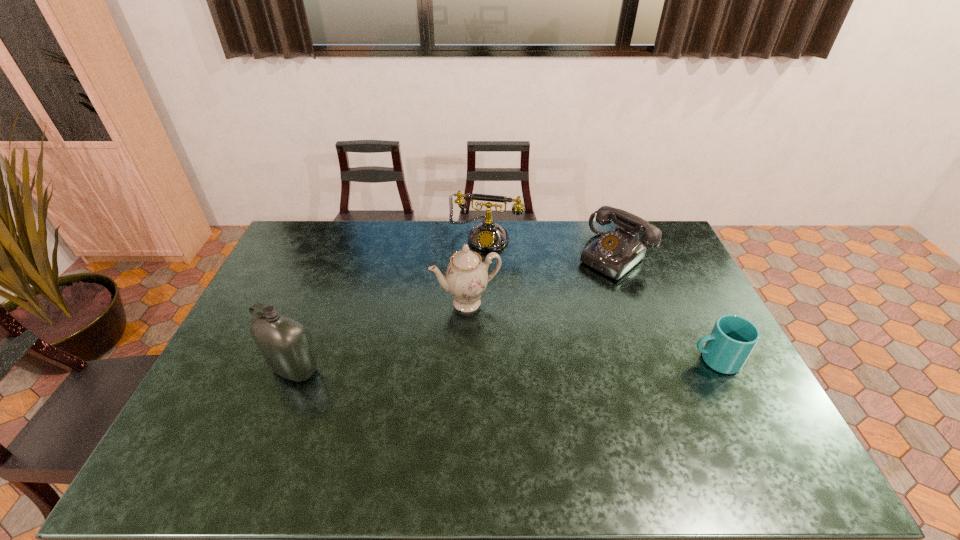
The image size is (960, 540). Identify the location of vacant spot on the desktop that is between the bottle and the cup and is positioned on the spout of the third nearest object. 493,364.

Locate an element on the screen. This screenshot has height=540, width=960. vacant space on the desktop that is between the bottle and the shortest object and is positioned on the dial of the right telephone is located at coordinates (475, 365).

Identify the location of vacant space on the desktop that is between the bottle and the cup and is positioned on the dial of the third shortest object. (448, 366).